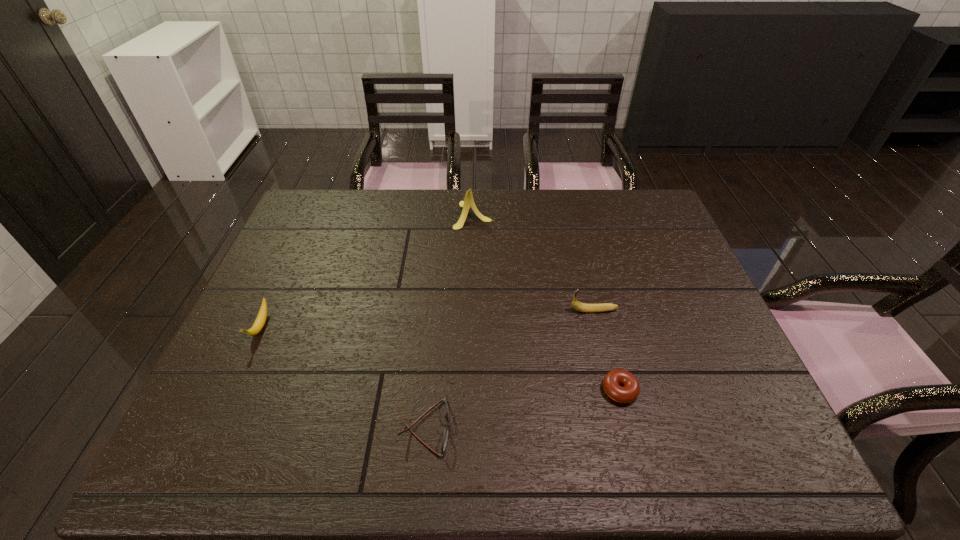
Find the location of a particular element. free location that satisfies the following two spatial constraints: 1. at the stem of the rightmost banana; 2. at the stem of the leftmost object is located at coordinates (598, 327).

At what (x,y) coordinates should I click in order to perform the action: click on vacant space that satisfies the following two spatial constraints: 1. on the front side of the tallest object; 2. on the front-facing side of the spectacles. Please return your answer as a coordinate pair (x, y). Image resolution: width=960 pixels, height=540 pixels. Looking at the image, I should click on (470, 427).

At what (x,y) coordinates should I click in order to perform the action: click on free space that satisfies the following two spatial constraints: 1. at the stem of the doughnut; 2. on the left side of the rightmost banana. Please return your answer as a coordinate pair (x, y). Looking at the image, I should click on (613, 390).